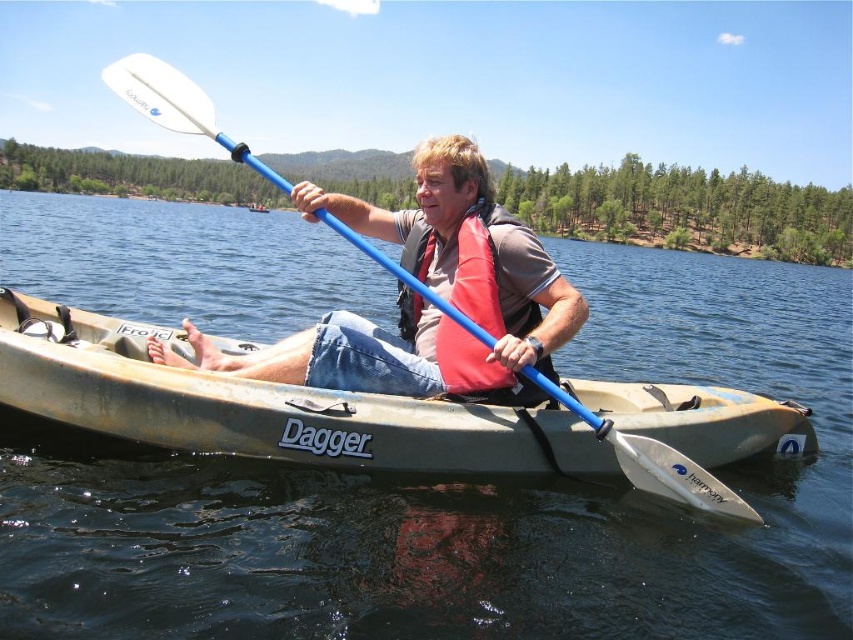
Is point (399, 371) positioned before point (178, 115)?

No, it is behind (178, 115).

Who is more distant from viewer, (498, 310) or (135, 80)?

Point (498, 310)

You are a GUI agent. You are given a task and a screenshot of the screen. Output one action in this format:
    pyautogui.click(x=<x>, y=<y>)
    Task: Click on the matte blue kayak at center
    
    Given the screenshot: What is the action you would take?
    pyautogui.click(x=422, y=300)

Who is higher up, white plastic paddle at center or red matte life jacket at center?

white plastic paddle at center

Consider the image. Is white plastic paddle at center behind red matte life jacket at center?

No, it is not.

Who is more distant from viewer, (x=454, y=312) or (x=461, y=252)?

Positioned behind is point (x=461, y=252).

Where is `white plastic paddle at center`? The width and height of the screenshot is (853, 640). white plastic paddle at center is located at coordinates (654, 461).

Measure the distance between clear blue water at center and red matte life jacket at center.

clear blue water at center is 15.55 meters from red matte life jacket at center.

Between clear blue water at center and red matte life jacket at center, which one appears on the left side from the viewer's perspective?

From the viewer's perspective, clear blue water at center appears more on the left side.

Is point (140, 564) positioned after point (468, 301)?

No, (140, 564) is in front of (468, 301).

At what (x,y) coordinates should I click in order to perform the action: click on clear blue water at center. Please return your answer as a coordinate pair (x, y). The height and width of the screenshot is (640, 853). Looking at the image, I should click on (468, 502).